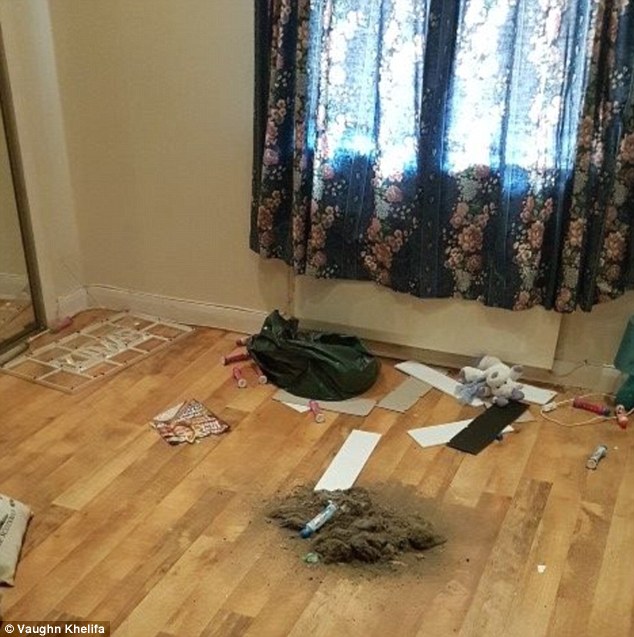
The height and width of the screenshot is (637, 634). What are the coordinates of `edge of the mirror` in the screenshot? It's located at (39, 311).